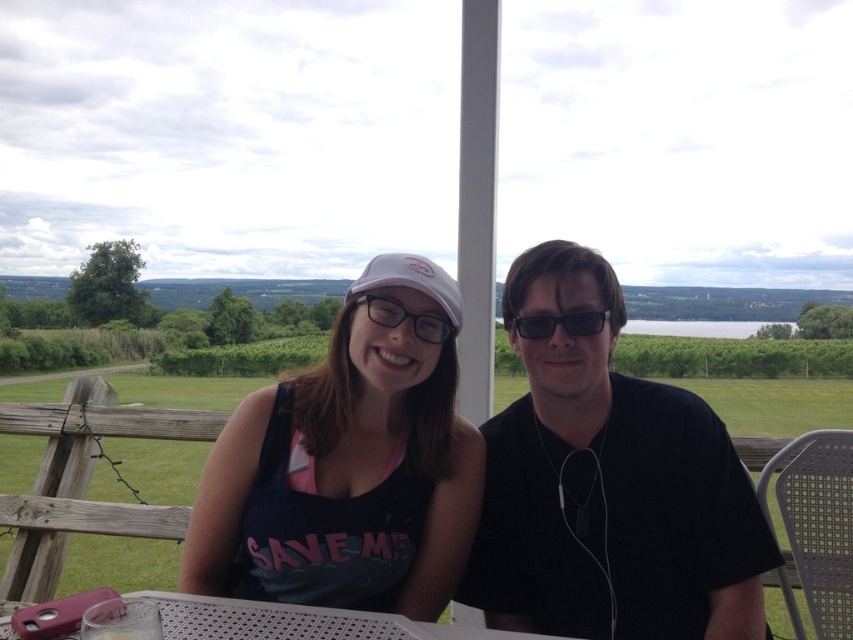
Question: Which of the following is the closest to the observer?

Choices:
 (A) (427, 536)
 (B) (260, 627)
 (C) (569, 324)
 (D) (619, 497)

Answer: (B)

Question: Which object appears farthest from the camera in this image?

Choices:
 (A) matte pink cap at center
 (B) white plastic table at lower center

Answer: (A)

Question: Is black matte shirt at center thinner than white plastic table at lower center?

Choices:
 (A) no
 (B) yes

Answer: (B)

Question: Does black matte shirt at center appear on the left side of matte pink cap at center?

Choices:
 (A) yes
 (B) no

Answer: (B)

Question: From the image, what is the correct spatial relationship of matte pink cap at center in relation to black plastic sunglasses at center?

Choices:
 (A) left
 (B) right

Answer: (A)

Question: Which point is closer to the camera?

Choices:
 (A) (364, 296)
 (B) (582, 323)

Answer: (B)